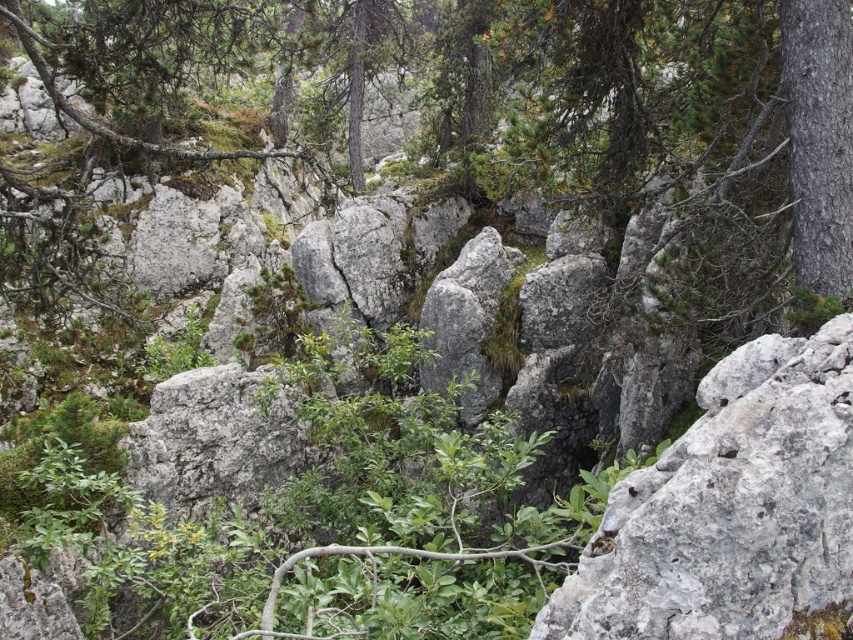
Who is taller, gray rough rock at center or smooth bark tree at right?

With more height is smooth bark tree at right.

In the scene shown: Who is more forward, [786,388] or [820,253]?

Point [786,388]

The height and width of the screenshot is (640, 853). I want to click on gray rough rock at center, so click(729, 508).